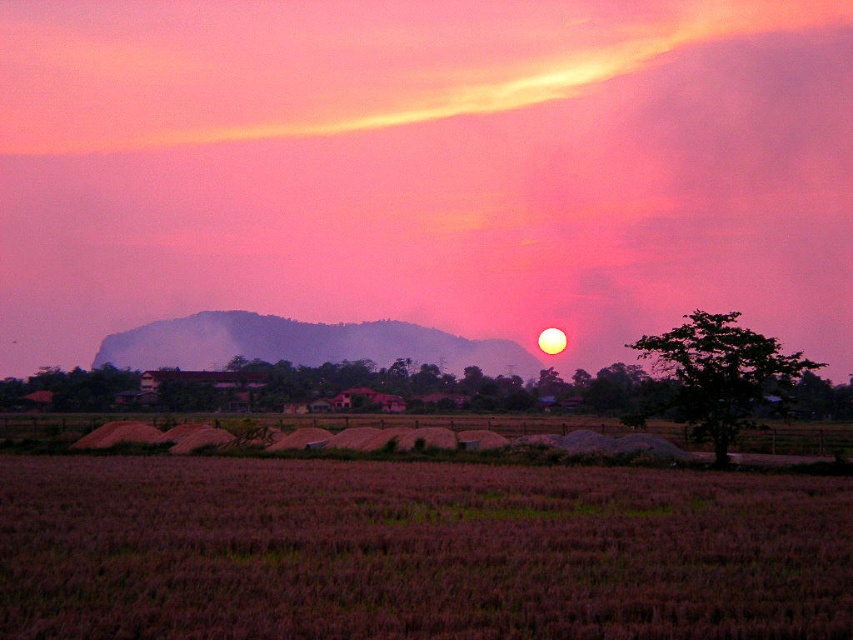
You are standing at the point marked as point (682, 77) in the image. The sun is setting near the right side of the mountain range. Can you see the sun directly from your current position?

The point (682, 77) is 166.87 meters away from the viewer. Since the sun is partially obscured by the distant mountain range on the right, and the viewer is at the point, they might have an unobstructed view of the sun depending on the terrain between them and the mountains. However, without specific information about elevation or intervening obstacles, it is uncertain. The answer cannot be definitively determined with the given data.

You are a photographer planning to capture the sunset in this rural landscape. You want to ensure the pink matte cloud at upper center and the purple matte rice field at lower center are both visible in your frame. Based on their positions, which object will appear higher in the photo?

The pink matte cloud at upper center will appear higher in the photo since it is positioned above the purple matte rice field at lower center.

You are standing in the middle of the purple matte rice field at lower center and want to walk towards the dark green leafy tree at right. Which direction should you head?

You should head to the right because the dark green leafy tree at right is located to the right of the purple matte rice field at lower center.